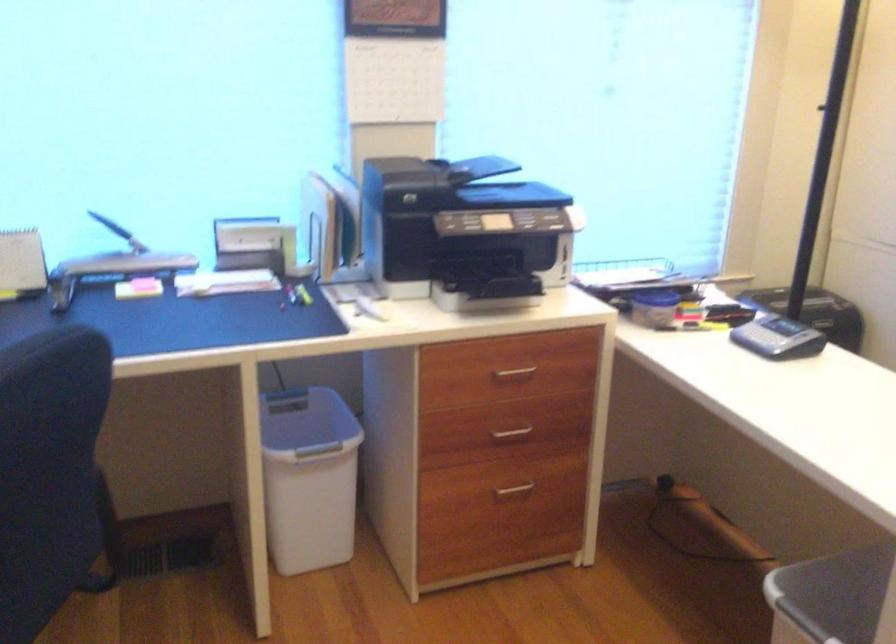
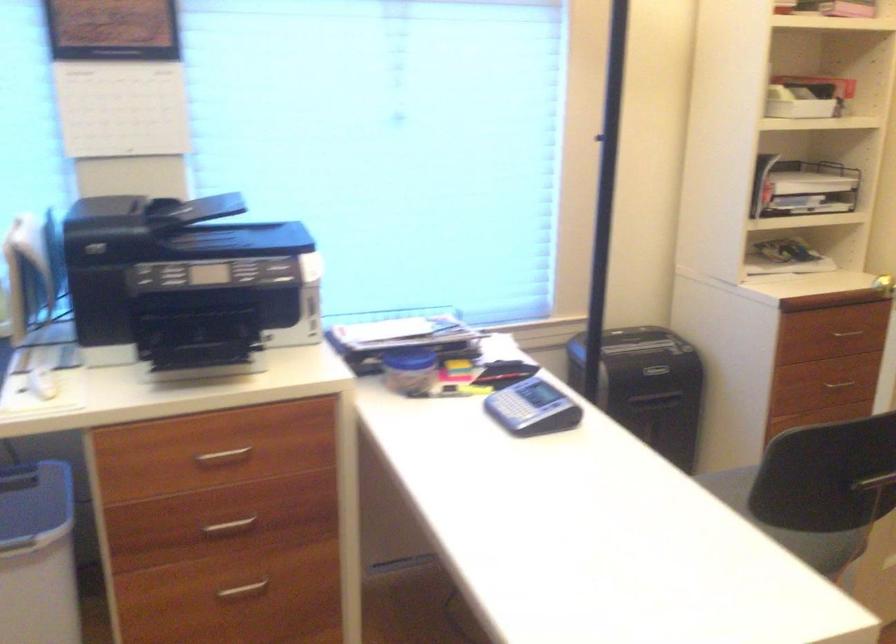
Where in the second image is the point corresponding to pixel 374 307 from the first image?

(41, 383)